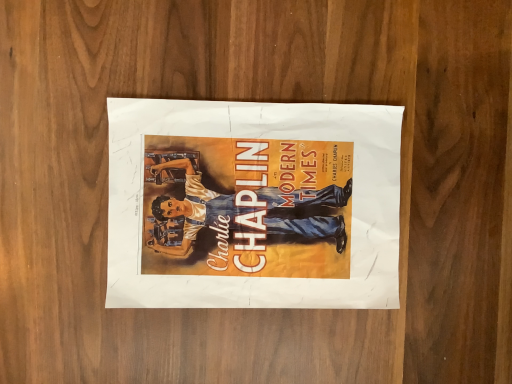
Image resolution: width=512 pixels, height=384 pixels. Identify the location of empty space that is ontop of matte paper poster at center (from a real-world perspective). (261, 195).